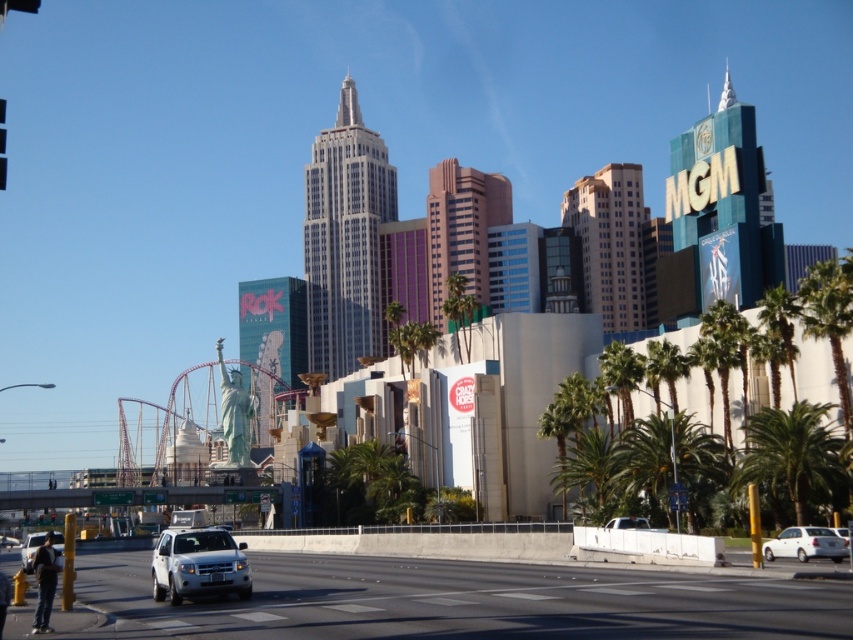
Question: Is white matte sedan at lower right closer to the viewer compared to silver metallic suv at lower left?

Choices:
 (A) no
 (B) yes

Answer: (A)

Question: Among these objects, which one is farthest from the camera?

Choices:
 (A) white matte suv at lower left
 (B) green leafy palm tree at lower right
 (C) green leafy palm tree at center-right
 (D) green leafy palm tree at right

Answer: (C)

Question: Which of these objects is positioned closest to the green leafy palm tree at lower right?

Choices:
 (A) white matte suv at lower left
 (B) silver metallic suv at lower left

Answer: (A)

Question: Is green leafy palm tree at right positioned at the back of silver metallic suv at lower left?

Choices:
 (A) no
 (B) yes

Answer: (B)

Question: Does white matte sedan at lower right appear on the left side of white glossy car at center?

Choices:
 (A) yes
 (B) no

Answer: (B)

Question: Among these points, which one is nearest to the camera?

Choices:
 (A) (601, 497)
 (B) (784, 544)

Answer: (B)